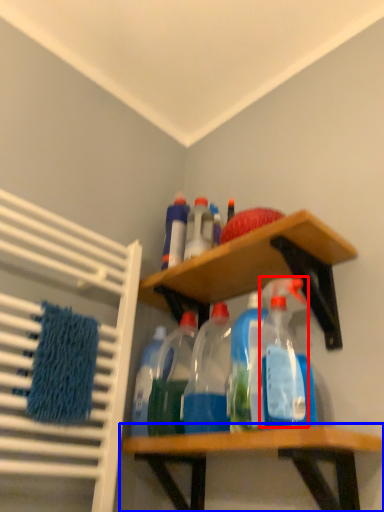
Question: Which object appears farthest to the camera in this image, cleaning product (highlighted by a red box) or shelf (highlighted by a blue box)?

Choices:
 (A) cleaning product
 (B) shelf

Answer: (A)